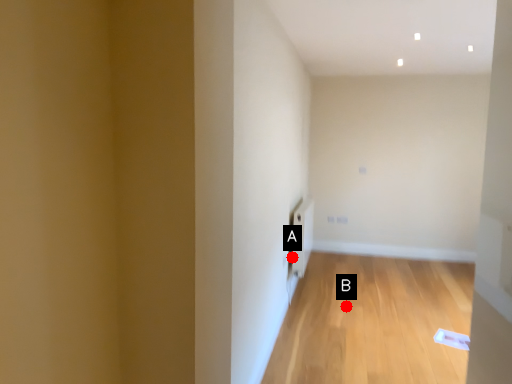
Question: Two points are circled on the image, labeled by A and B beside each circle. Which of the following is the closest to the observer?

Choices:
 (A) A is closer
 (B) B is closer

Answer: (B)